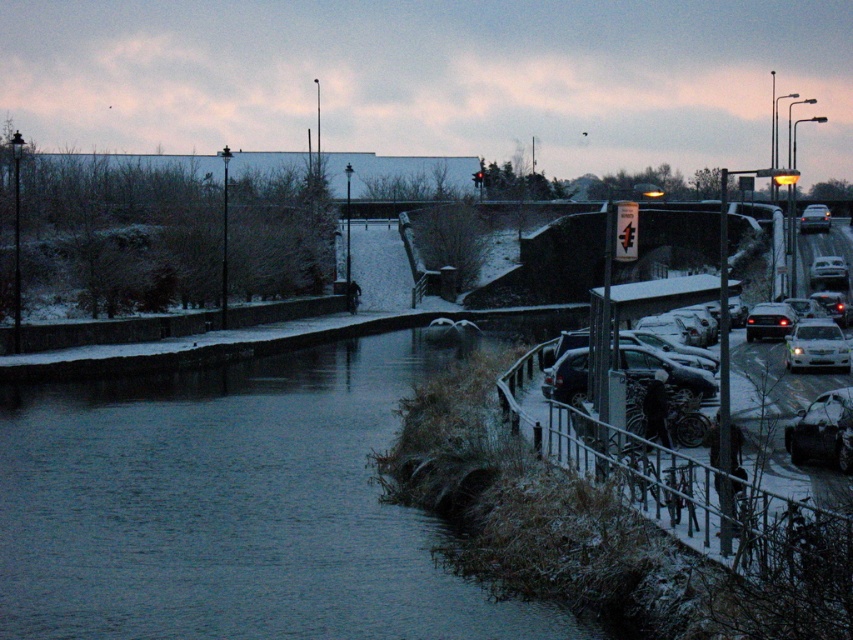
Measure the distance between snow-covered car at right and shiny black sedan at right.

7.35 meters

Is point (799, 449) farther from camera compared to point (764, 314)?

No, it is in front of (764, 314).

At what (x,y) coordinates should I click in order to perform the action: click on snow-covered car at right. Please return your answer as a coordinate pair (x, y). The image size is (853, 640). Looking at the image, I should click on (821, 432).

Can you confirm if snow-covered car at right is shorter than shiny silver car at lower right?

No, snow-covered car at right is not shorter than shiny silver car at lower right.

Does snow-covered car at right have a greater height compared to shiny silver car at lower right?

Yes.

At what (x,y) coordinates should I click in order to perform the action: click on snow-covered car at right. Please return your answer as a coordinate pair (x, y). The image size is (853, 640). Looking at the image, I should click on (821, 432).

Is snow-covered car at right further to camera compared to white matte car at right?

No.

Is snow-covered car at right positioned in front of white matte car at right?

Yes, it is in front of white matte car at right.

Does point (837, 355) come closer to viewer compared to point (811, 282)?

Yes, point (837, 355) is in front of point (811, 282).

Image resolution: width=853 pixels, height=640 pixels. I want to click on snow-covered car at right, so click(x=821, y=432).